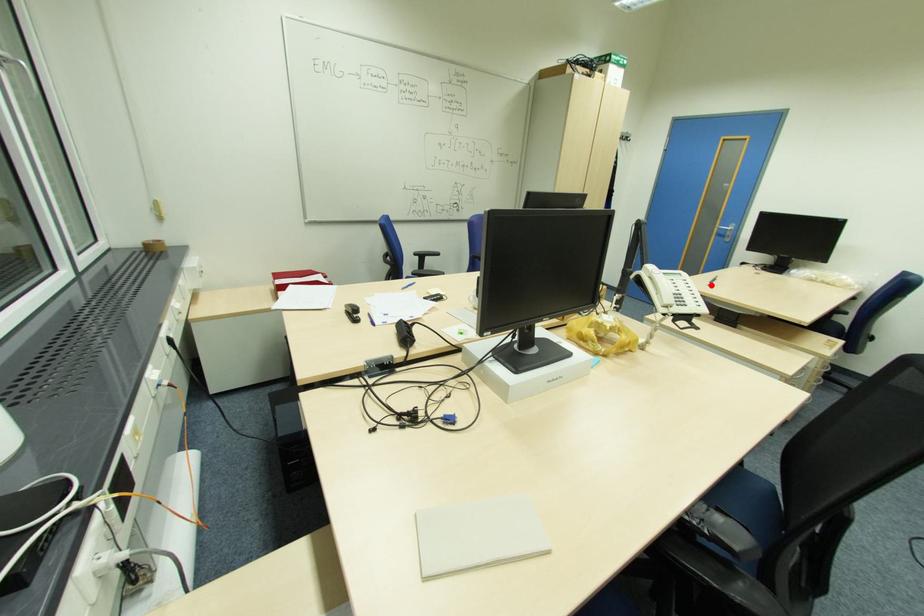
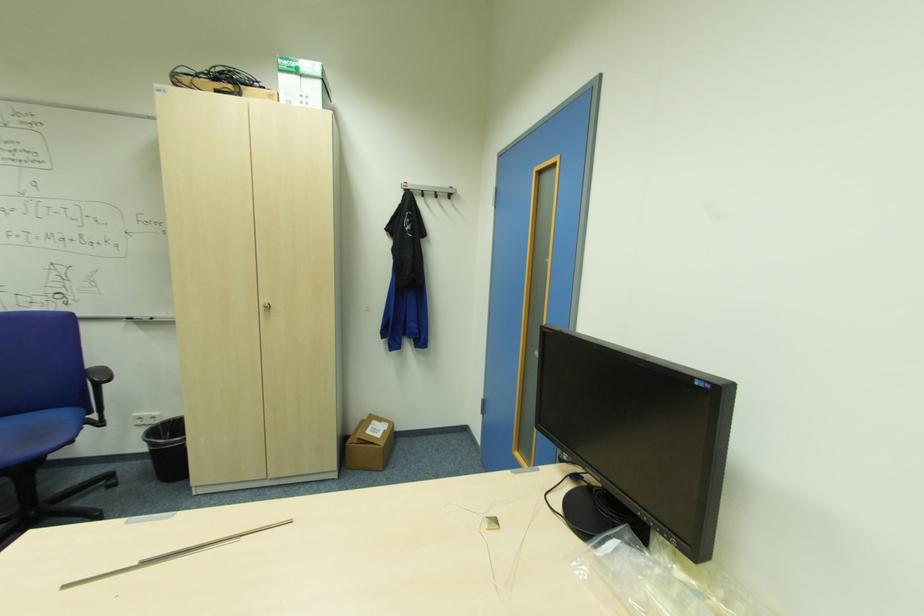
In the second image, find the point that corresponds to the highlighted location in the first image.

(63, 589)